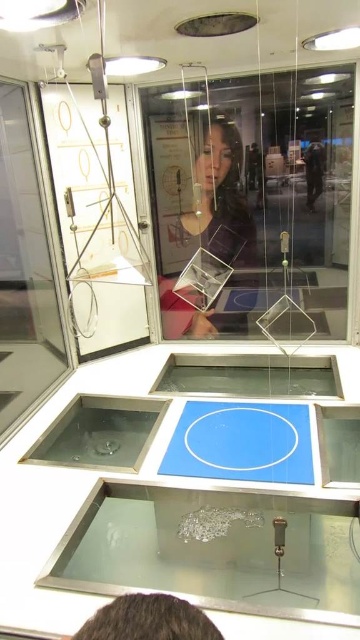
Consider the image. Which of these two, transparent glass at lower center or matte glass cube at center, stands taller?

matte glass cube at center is taller.

Is transparent glass at lower center wider than matte glass cube at center?

Yes.

Measure the distance between transparent glass at lower center and camera.

transparent glass at lower center is 1.48 meters away from camera.

The image size is (360, 640). Find the location of `transparent glass at lower center`. transparent glass at lower center is located at coordinates (213, 550).